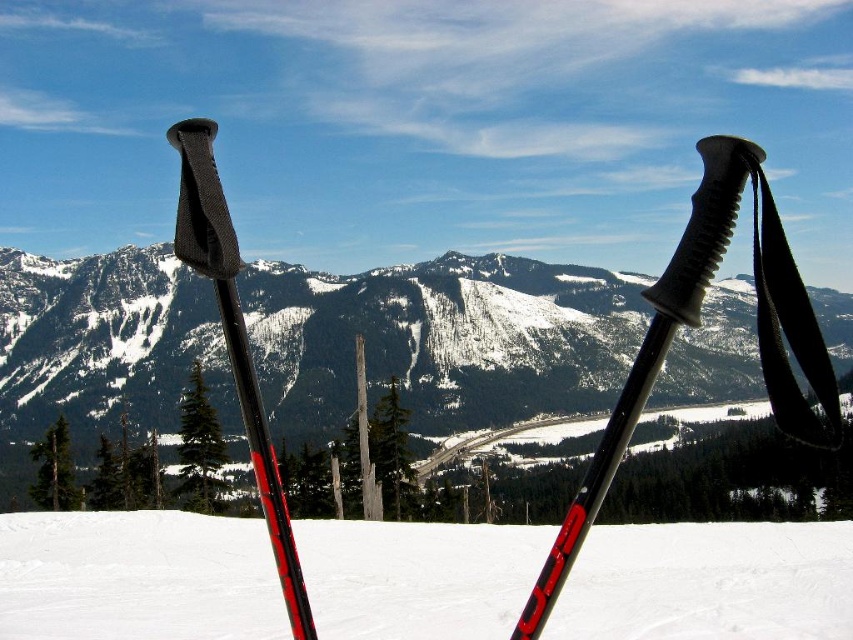
Question: In this image, where is matte black ski poles at center located relative to black fabric strap at right?

Choices:
 (A) below
 (B) above

Answer: (A)

Question: Which point is farther to the camera?

Choices:
 (A) matte black ski poles at center
 (B) snowy granite mountain at center
 (C) black rubber ski pole at center
 (D) matte black ski pole at left

Answer: (B)

Question: Can you confirm if matte black ski poles at center is bigger than black rubber ski pole at center?

Choices:
 (A) no
 (B) yes

Answer: (A)

Question: Which of the following is the closest to the observer?

Choices:
 (A) matte black ski pole at left
 (B) black rubber ski pole at center

Answer: (B)

Question: Which point is farther from the camera taking this photo?

Choices:
 (A) (631, 419)
 (B) (762, 596)
 (C) (219, 307)

Answer: (B)

Question: Does black rubber ski pole at center have a greater width compared to matte black ski pole at left?

Choices:
 (A) yes
 (B) no

Answer: (A)